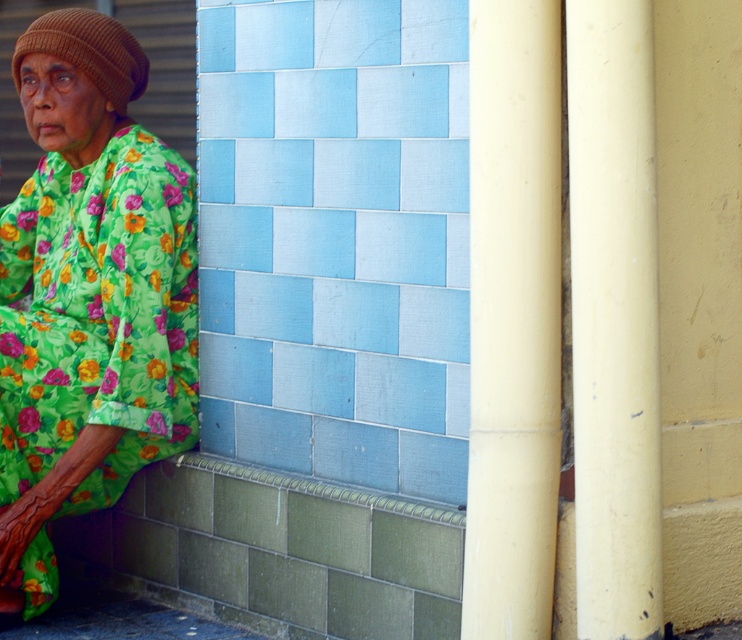
Is smooth yellow pillar at right below smooth cream-colored pillar at right?

Yes, smooth yellow pillar at right is below smooth cream-colored pillar at right.

Does point (485, 164) come closer to viewer compared to point (620, 420)?

That is False.

Find the location of a particular element. smooth yellow pillar at right is located at coordinates (513, 317).

Who is shorter, green floral dress at left or green textured curb at lower left?

green textured curb at lower left is shorter.

Is green floral dress at left to the left of green textured curb at lower left from the viewer's perspective?

Yes, green floral dress at left is to the left of green textured curb at lower left.

Is point (101, 468) more distant than point (459, 522)?

Yes.

Find the location of a particular element. Image resolution: width=742 pixels, height=640 pixels. green floral dress at left is located at coordinates (88, 296).

Is smooth yellow pillar at right shorter than green textured curb at lower left?

Incorrect, smooth yellow pillar at right's height does not fall short of green textured curb at lower left's.

Does point (473, 340) come farther from viewer compared to point (444, 524)?

That is False.

The image size is (742, 640). Identify the location of smooth yellow pillar at right. [513, 317].